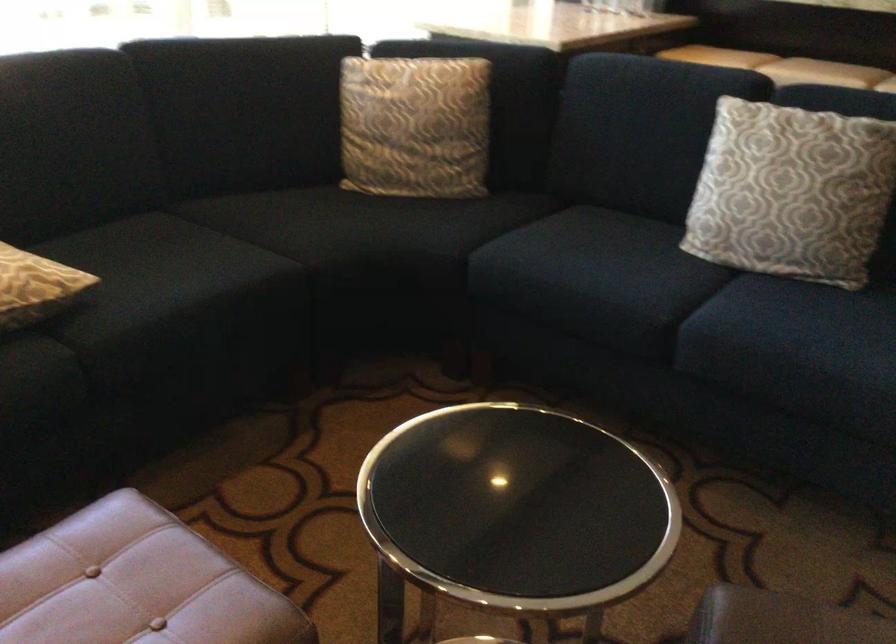
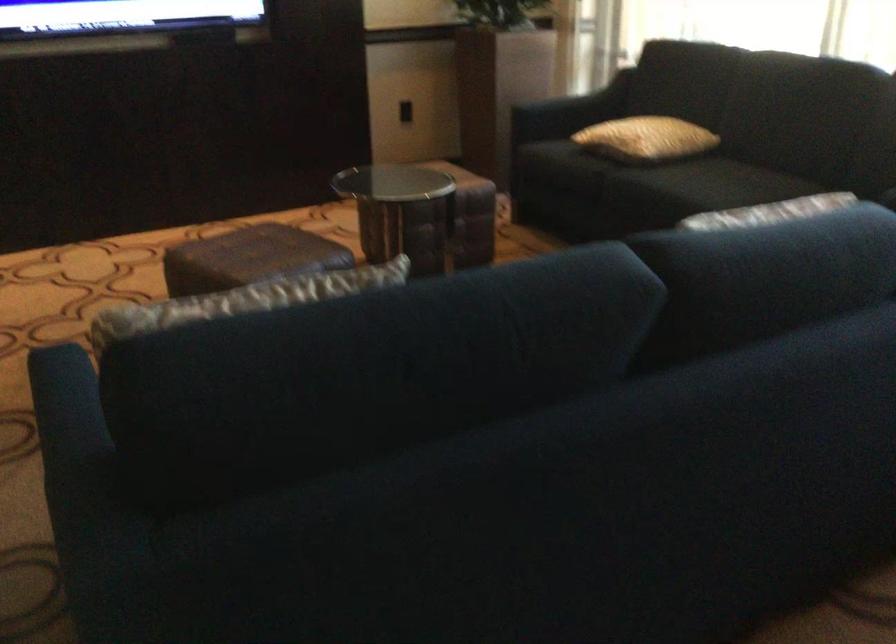
Question: I am providing you with two images of the same scene from different viewpoints. Please identify which objects are invisible in image2.

Choices:
 (A) sofa sitting surface
 (B) dark sofa armrest
 (C) metal food container
 (D) sofa armrest

Answer: (A)